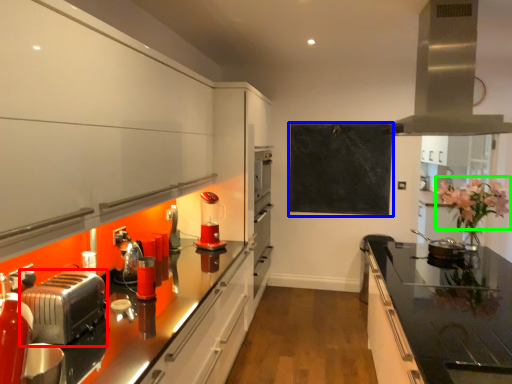
Question: Which is nearer to the toaster (highlighted by a red box)? bulletin board (highlighted by a blue box) or flower (highlighted by a green box).

Choices:
 (A) bulletin board
 (B) flower

Answer: (B)